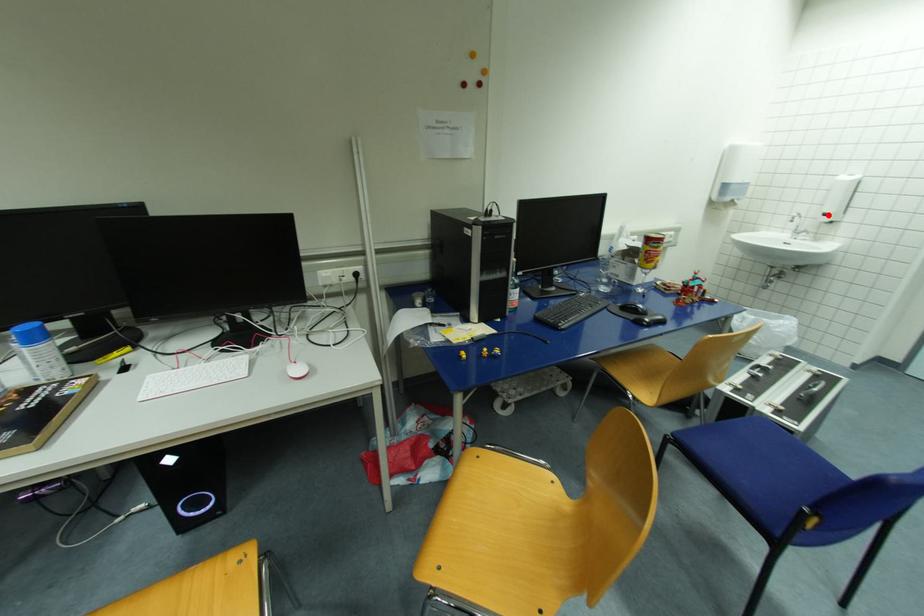
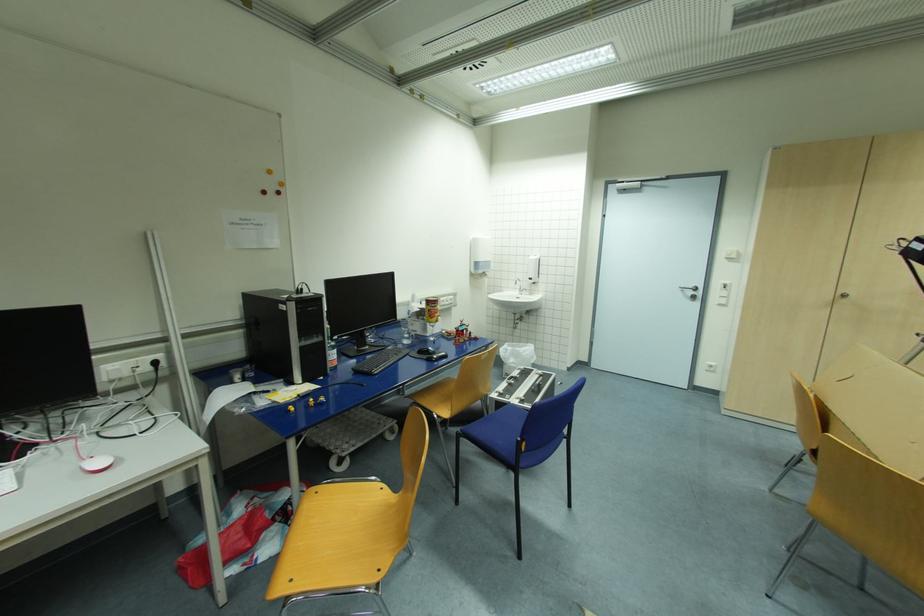
In the second image, find the point that corresponds to the highlighted location in the first image.

(533, 280)